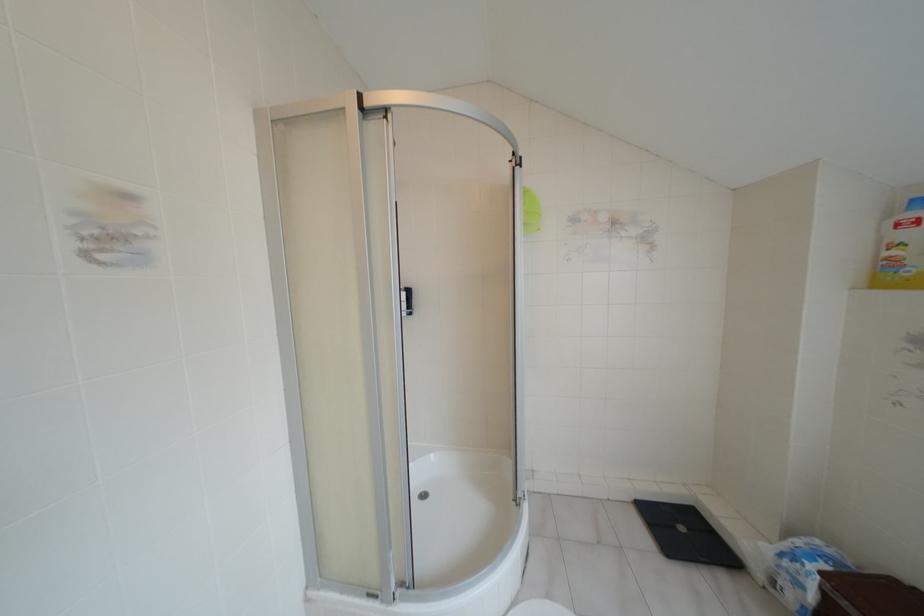
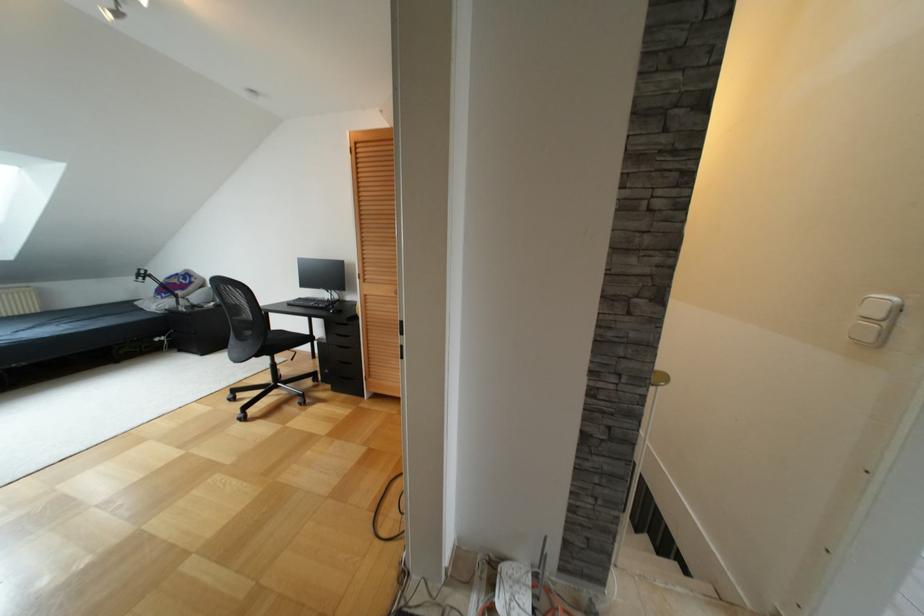
Question: Which direction would the cameraman need to move to produce the second image? Reply with the corresponding letter.

Choices:
 (A) Left
 (B) Right
 (C) Forward
 (D) Backward

Answer: (A)